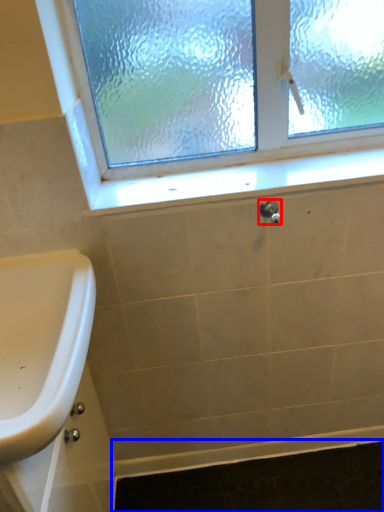
Question: Which point is further to the camera, plumbing fixture (highlighted by a red box) or bath mat (highlighted by a blue box)?

Choices:
 (A) plumbing fixture
 (B) bath mat

Answer: (B)